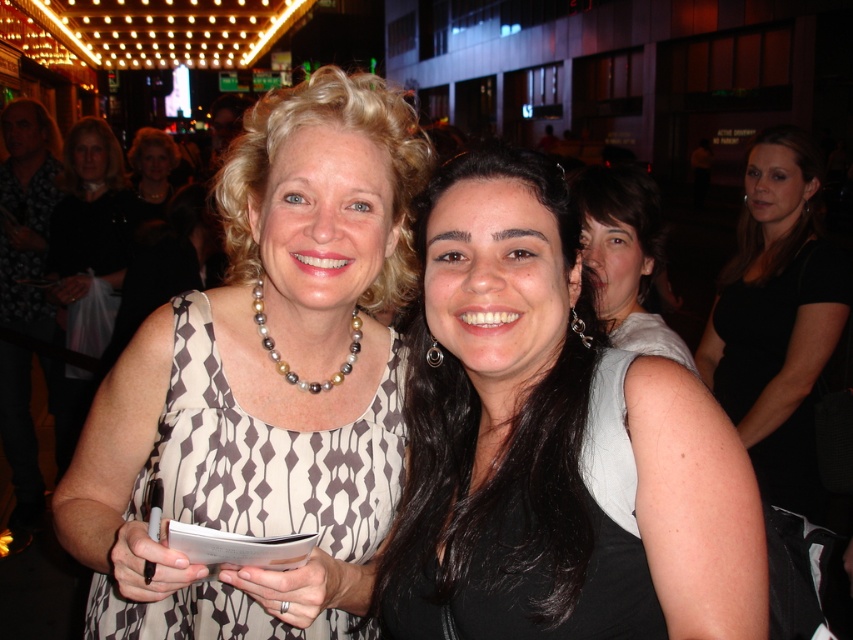
Is black dress at center shorter than matte gray shirt at center?

Incorrect, black dress at center's height does not fall short of matte gray shirt at center's.

At what (x,y) coordinates should I click in order to perform the action: click on black dress at center. Please return your answer as a coordinate pair (x, y). The width and height of the screenshot is (853, 640). Looking at the image, I should click on (776, 317).

Is point (596, 419) positioned in front of point (202, 417)?

Yes, it is in front of point (202, 417).

Can you confirm if black matte dress at center is taller than printed fabric dress at center?

Incorrect, black matte dress at center's height is not larger of printed fabric dress at center's.

Does point (474, 403) lie in front of point (299, 497)?

That is False.

Where is `black matte dress at center`? The width and height of the screenshot is (853, 640). black matte dress at center is located at coordinates (527, 536).

Who is more forward, (80, 412) or (613, 269)?

Point (613, 269)

The height and width of the screenshot is (640, 853). Describe the element at coordinates (88, 216) in the screenshot. I see `black satin dress at center` at that location.

Is point (67, 173) less distant than point (634, 195)?

No, (67, 173) is behind (634, 195).

Identify the location of black satin dress at center. (88, 216).